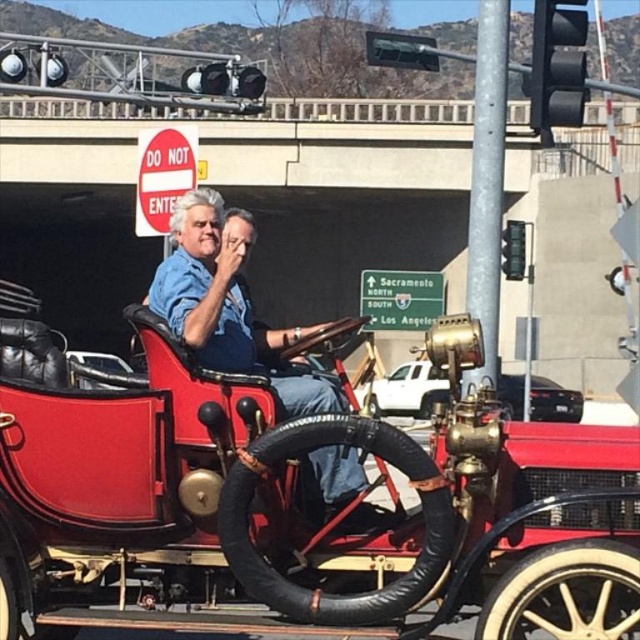
You are a photographer standing in front of the vintage red automobile. You notice the matte blue shirt at center and the red leather seat at center. Which object is closer to you?

The matte blue shirt at center is closer to you since it is positioned in front of the red leather seat at center.

You are a surveyor trying to map the coordinates of the concrete bridge at upper center in the image. What are its coordinates?

The concrete bridge at upper center is located at point (x=369, y=109).